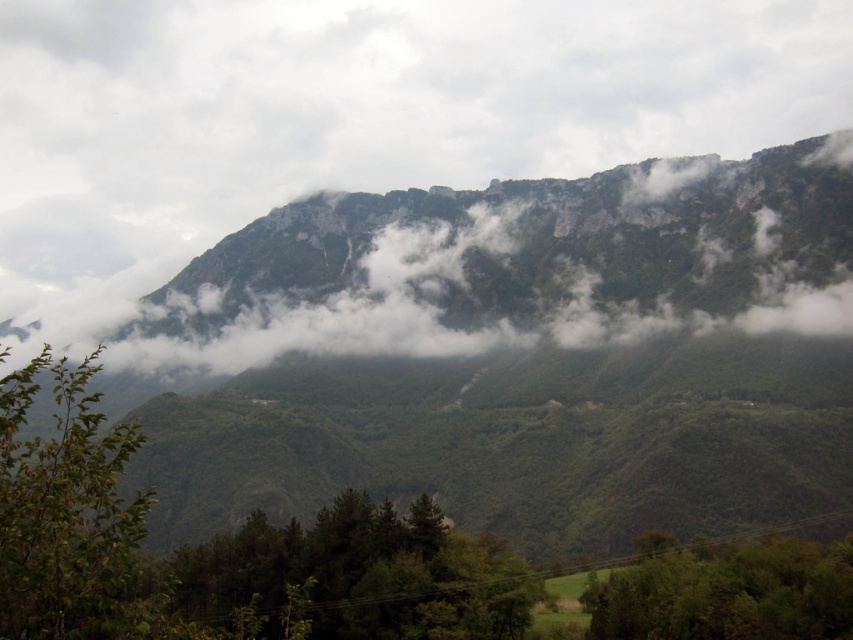
You are standing in the mountain landscape and want to take a photo of both the green leafy tree at lower left and the green leafy tree at lower right. Which tree should you focus on first to ensure both are in clear view?

You should focus on the green leafy tree at lower left first because it is closer to you than the green leafy tree at lower right, so adjusting focus from near to far will help capture both clearly.